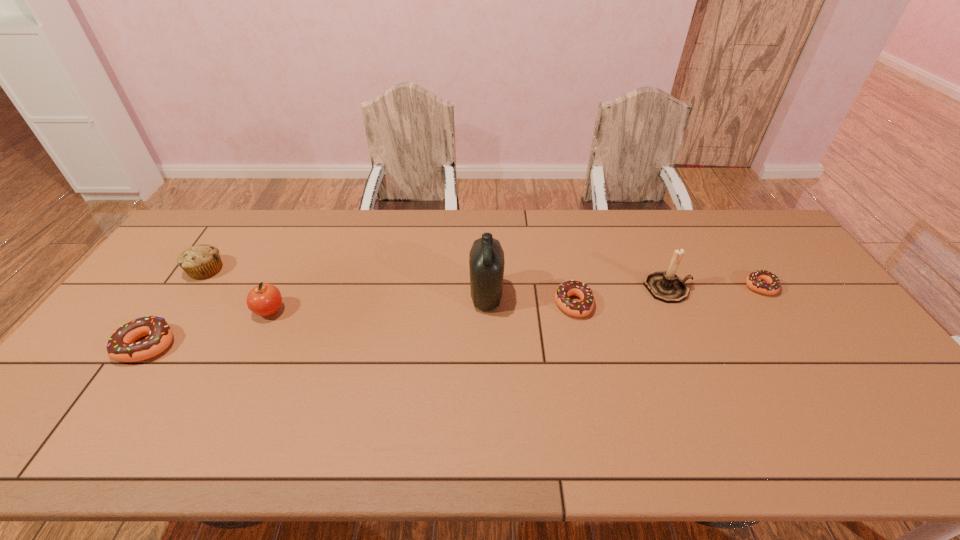
Where is `doughnut positioned at the left edge`? doughnut positioned at the left edge is located at coordinates (121, 346).

Locate an element on the screen. This screenshot has width=960, height=540. muffin located at the left edge is located at coordinates (202, 261).

Find the location of `object located in the right edge section of the desktop`. object located in the right edge section of the desktop is located at coordinates (764, 282).

Where is `free space at the far edge of the desktop`? Image resolution: width=960 pixels, height=540 pixels. free space at the far edge of the desktop is located at coordinates (650, 235).

I want to click on vacant area at the near edge of the desktop, so click(x=726, y=392).

This screenshot has height=540, width=960. In the image, there is a desktop. Find the location of `free space at the left edge`. free space at the left edge is located at coordinates (102, 357).

I want to click on vacant area at the right edge of the desktop, so click(x=791, y=258).

Image resolution: width=960 pixels, height=540 pixels. In the image, there is a desktop. In order to click on vacant space at the far left corner in this screenshot , I will do `click(240, 220)`.

The height and width of the screenshot is (540, 960). Find the location of `free space between the fourth object from left to right and the muffin`. free space between the fourth object from left to right and the muffin is located at coordinates (347, 284).

Find the location of `empty location between the second shortest object and the tallest object`. empty location between the second shortest object and the tallest object is located at coordinates (530, 301).